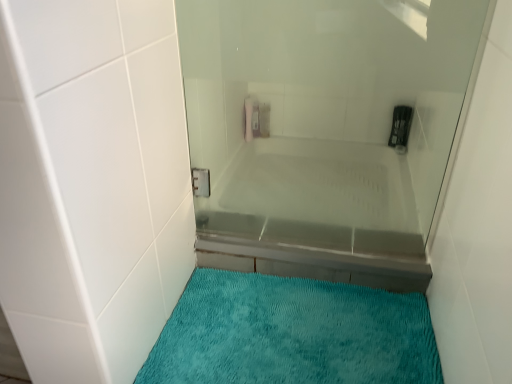
Question: From a real-world perspective, is teal plush bath mat at lower center located beneath clear glass bathtub at center?

Choices:
 (A) yes
 (B) no

Answer: (A)

Question: Does teal plush bath mat at lower center have a lesser height compared to clear glass bathtub at center?

Choices:
 (A) yes
 (B) no

Answer: (A)

Question: Does teal plush bath mat at lower center turn towards clear glass bathtub at center?

Choices:
 (A) yes
 (B) no

Answer: (B)

Question: Is teal plush bath mat at lower center positioned with its back to clear glass bathtub at center?

Choices:
 (A) yes
 (B) no

Answer: (B)

Question: From the image's perspective, is teal plush bath mat at lower center above clear glass bathtub at center?

Choices:
 (A) no
 (B) yes

Answer: (A)

Question: Is teal plush bath mat at lower center touching clear glass bathtub at center?

Choices:
 (A) no
 (B) yes

Answer: (A)

Question: Is clear glass bathtub at center aimed at teal plush bath mat at lower center?

Choices:
 (A) yes
 (B) no

Answer: (A)

Question: Does clear glass bathtub at center have a lesser width compared to teal plush bath mat at lower center?

Choices:
 (A) yes
 (B) no

Answer: (A)

Question: From a real-world perspective, does clear glass bathtub at center stand above teal plush bath mat at lower center?

Choices:
 (A) yes
 (B) no

Answer: (A)

Question: Does clear glass bathtub at center appear on the right side of teal plush bath mat at lower center?

Choices:
 (A) no
 (B) yes

Answer: (B)

Question: Can you confirm if clear glass bathtub at center is positioned to the left of teal plush bath mat at lower center?

Choices:
 (A) yes
 (B) no

Answer: (B)

Question: Considering the relative sizes of clear glass bathtub at center and teal plush bath mat at lower center in the image provided, is clear glass bathtub at center smaller than teal plush bath mat at lower center?

Choices:
 (A) no
 (B) yes

Answer: (A)

Question: From a real-world perspective, does transparent glass shower door at center stand above clear glass bathtub at center?

Choices:
 (A) yes
 (B) no

Answer: (A)